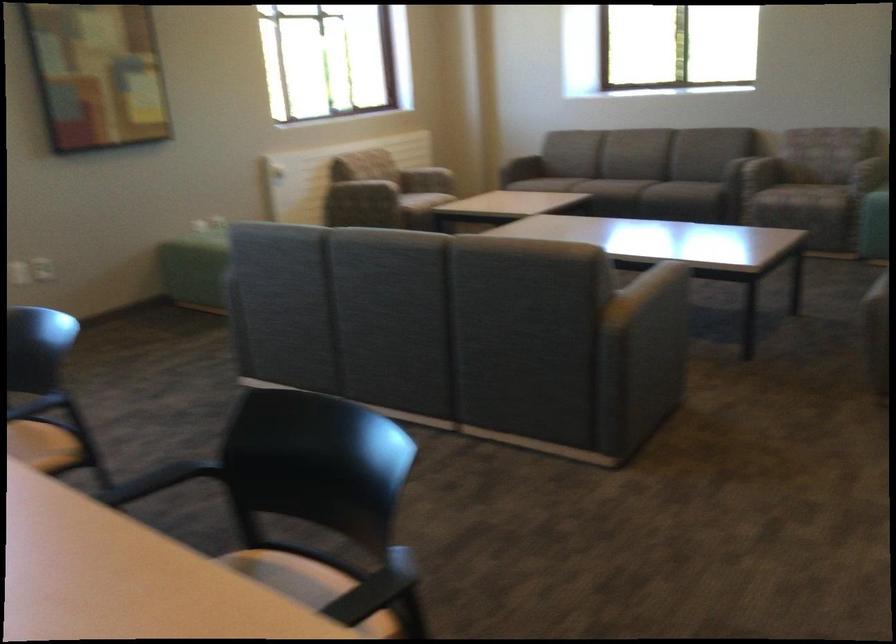
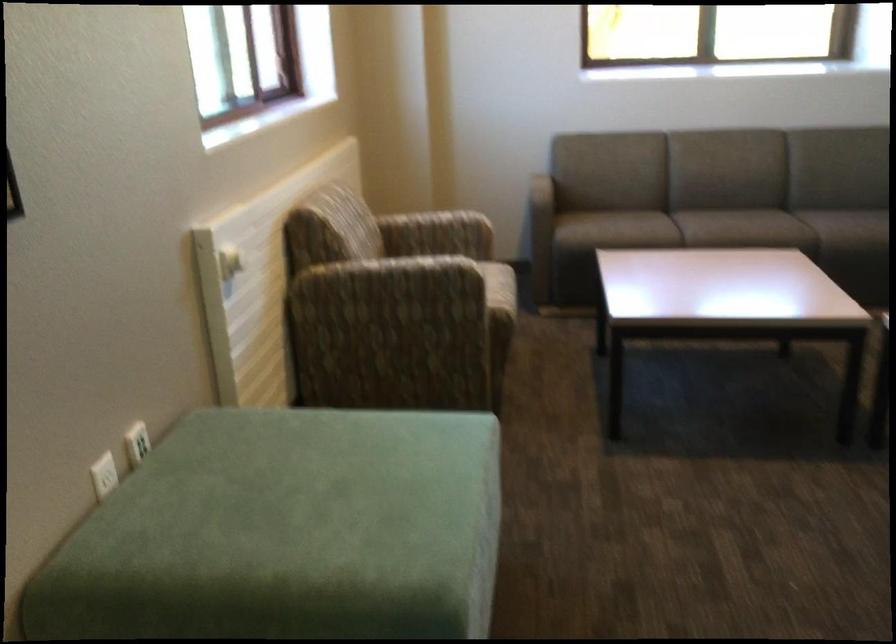
Where in the second image is the point corresponding to the point at 349,196 from the first image?

(386, 312)